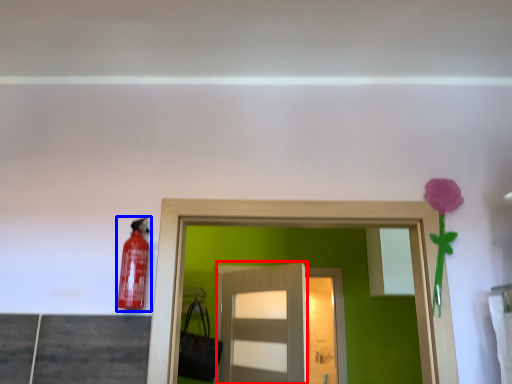
Question: Which point is further to the camera, door (highlighted by a red box) or extinguisher (highlighted by a blue box)?

Choices:
 (A) door
 (B) extinguisher

Answer: (A)